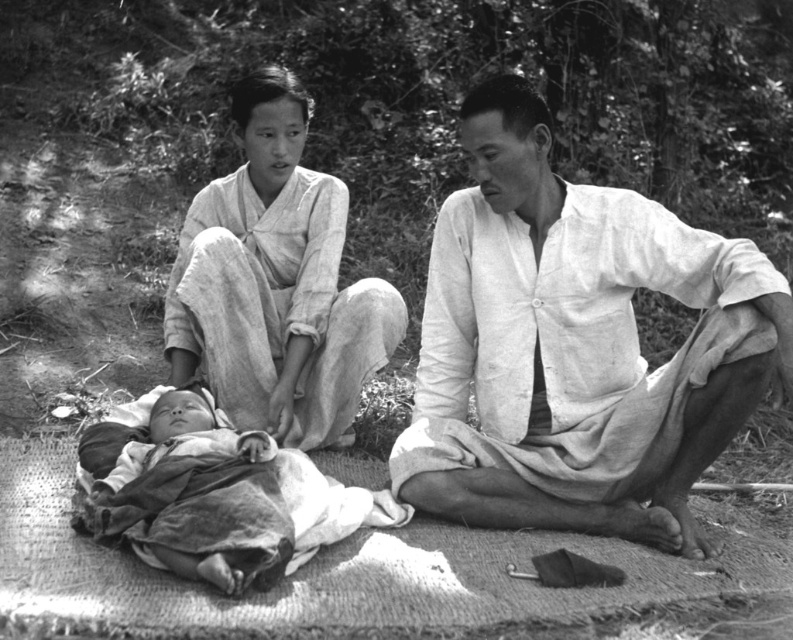
Question: From the image, what is the correct spatial relationship of light beige fabric shirt at center in relation to light beige fabric at upper left?

Choices:
 (A) left
 (B) right

Answer: (B)

Question: Does light beige fabric shirt at center have a smaller size compared to light beige fabric at upper left?

Choices:
 (A) no
 (B) yes

Answer: (A)

Question: Can you confirm if light beige fabric shirt at center is positioned to the right of light beige fabric at upper left?

Choices:
 (A) yes
 (B) no

Answer: (A)

Question: Which point is farther from the camera taking this photo?

Choices:
 (A) (721, 435)
 (B) (278, 68)

Answer: (B)